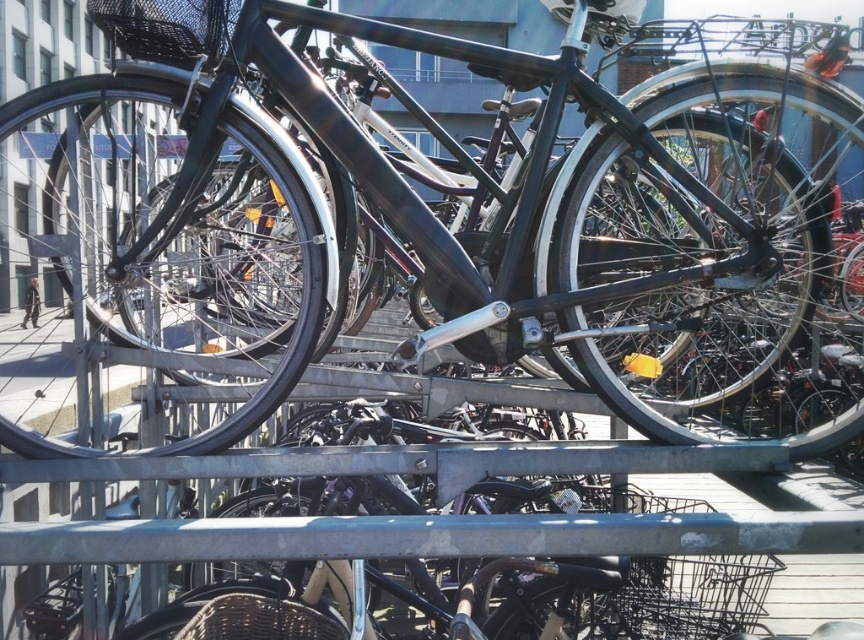
Question: Which point is farther to the camera?

Choices:
 (A) glossy black bicycle at center
 (B) black mesh basket at upper left
 (C) black woven basket at center

Answer: (C)

Question: Can you confirm if glossy black bicycle at center is positioned below black woven basket at center?

Choices:
 (A) no
 (B) yes

Answer: (A)

Question: Which object is closer to the camera taking this photo?

Choices:
 (A) black mesh basket at upper left
 (B) black woven basket at center

Answer: (A)

Question: Can you confirm if black mesh basket at upper left is positioned below black woven basket at center?

Choices:
 (A) yes
 (B) no

Answer: (B)

Question: Which of these objects is positioned farthest from the black woven basket at center?

Choices:
 (A) black mesh basket at upper left
 (B) glossy black bicycle at center

Answer: (B)

Question: Does black mesh basket at upper left have a smaller size compared to black woven basket at center?

Choices:
 (A) yes
 (B) no

Answer: (B)